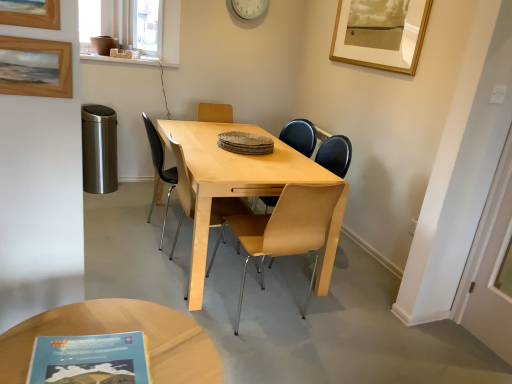
Find the location of a particular element. vacant region above light brown leather chair at center, marked as the first chair in a front-to-back arrangement (from a real-world perspective) is located at coordinates (234, 150).